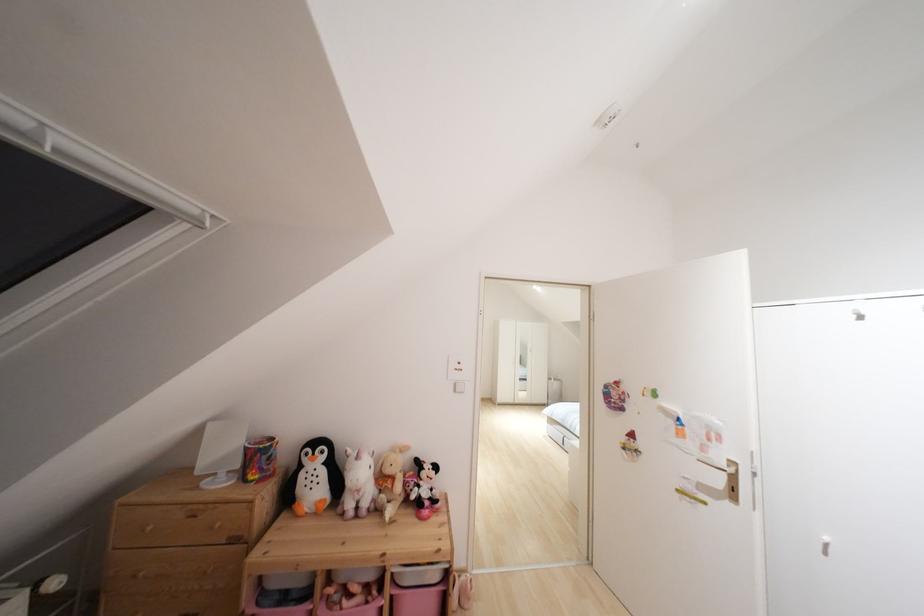
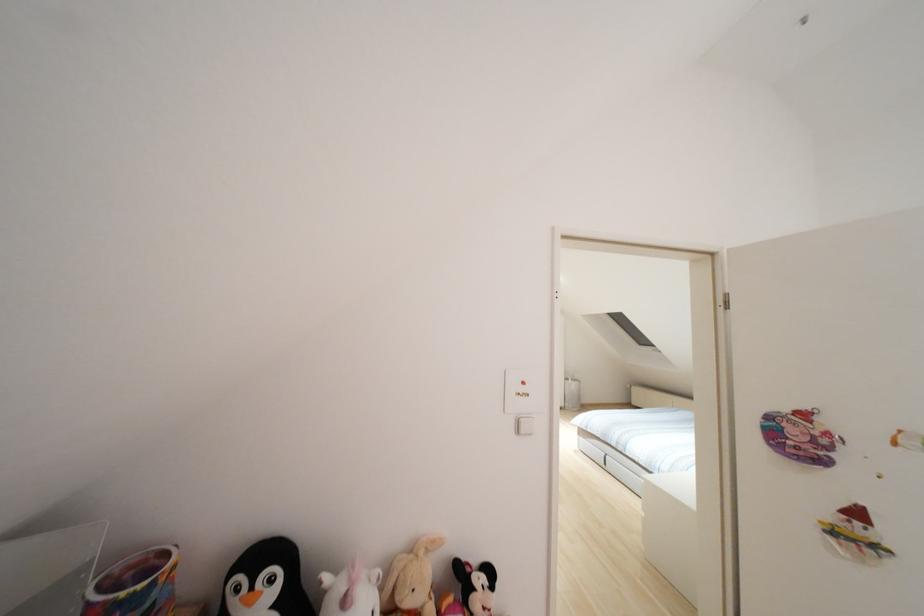
Where in the second image is the point corresponding to point (455, 390) from the first image?

(517, 431)